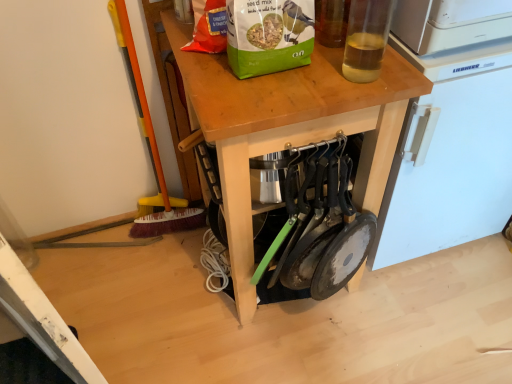
At what (x,y) coordinates should I click in order to perform the action: click on free space to the left of wooden at center. Please return your answer as a coordinate pair (x, y). Looking at the image, I should click on click(143, 283).